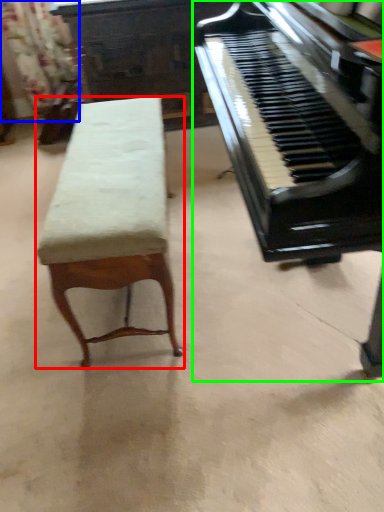
Question: Considering the real-world distances, which object is farthest from furniture (highlighted by a red box)? curtain (highlighted by a blue box) or piano (highlighted by a green box)?

Choices:
 (A) curtain
 (B) piano

Answer: (A)